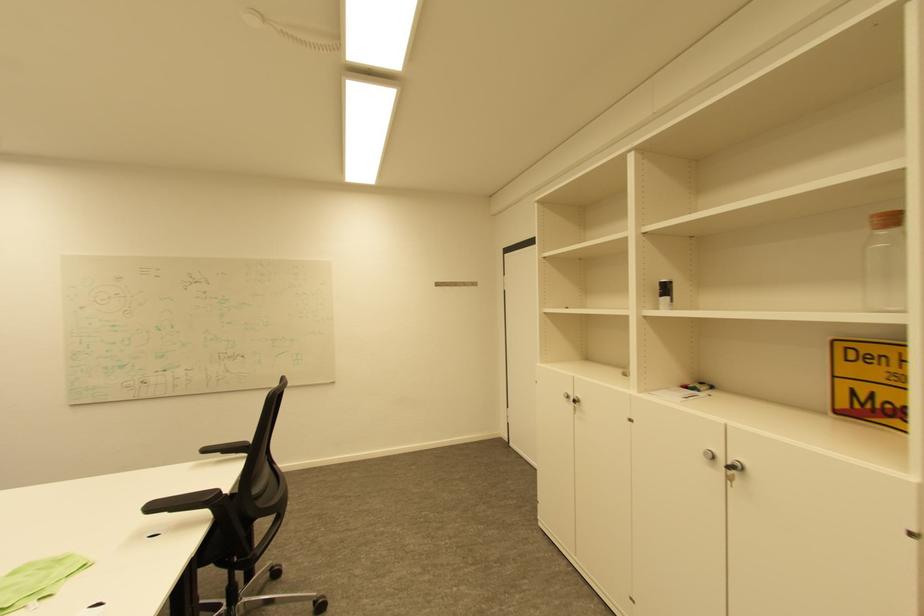
Where is `metal wall hook`? metal wall hook is located at coordinates (734, 469).